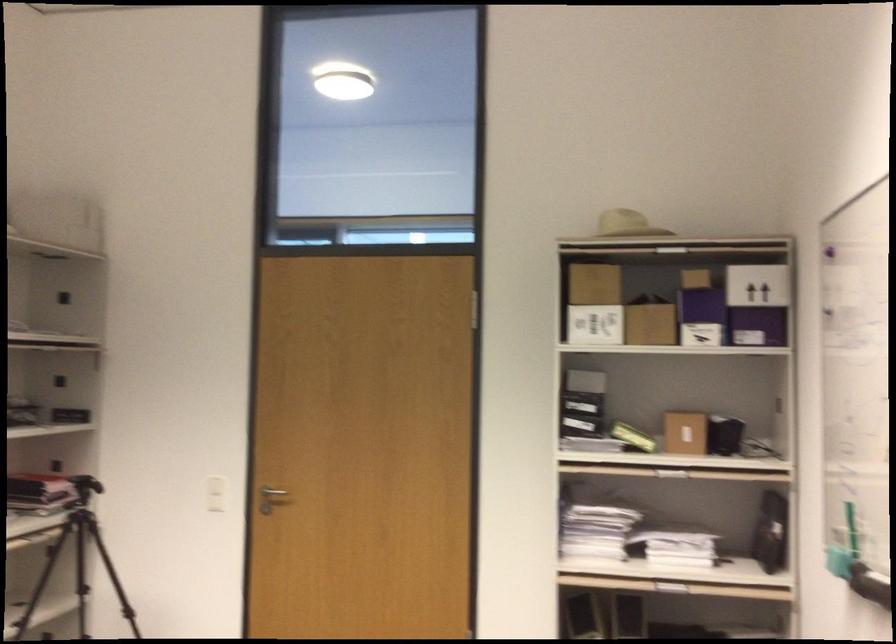
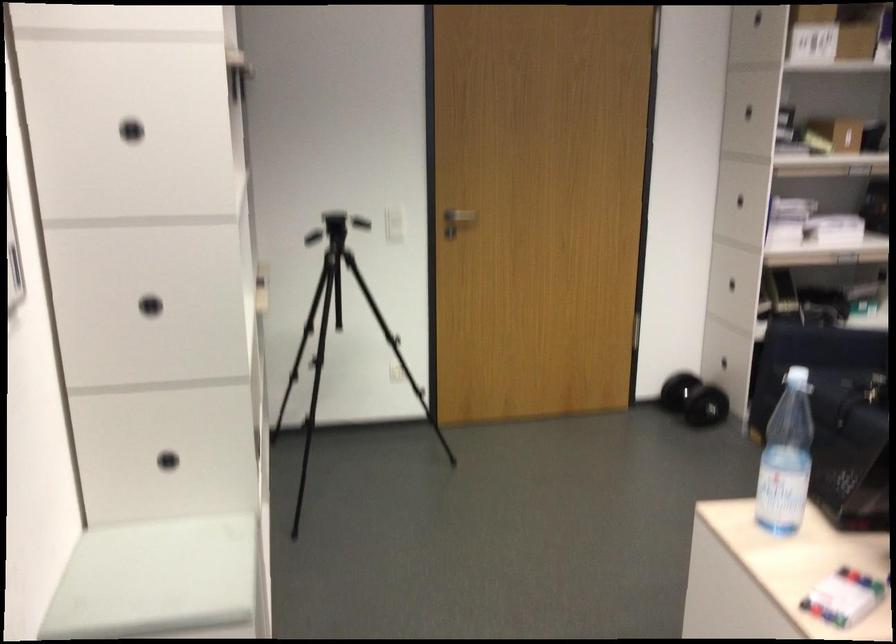
Question: What movement of the cameraman would produce the second image?

Choices:
 (A) Left
 (B) Right
 (C) Forward
 (D) Backward

Answer: (A)